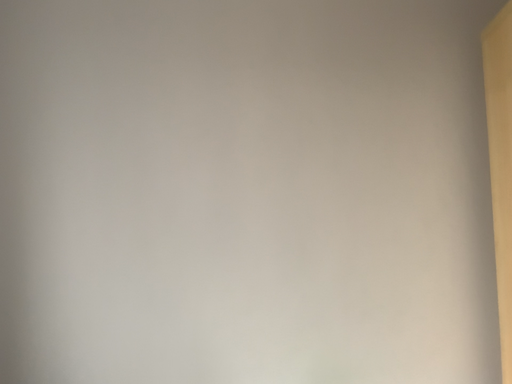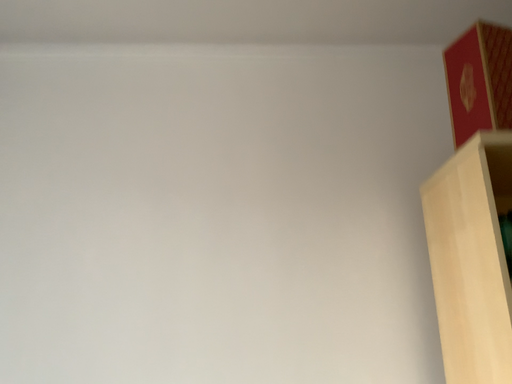
Question: Which way did the camera rotate in the video?

Choices:
 (A) rotated downward
 (B) rotated upward

Answer: (B)